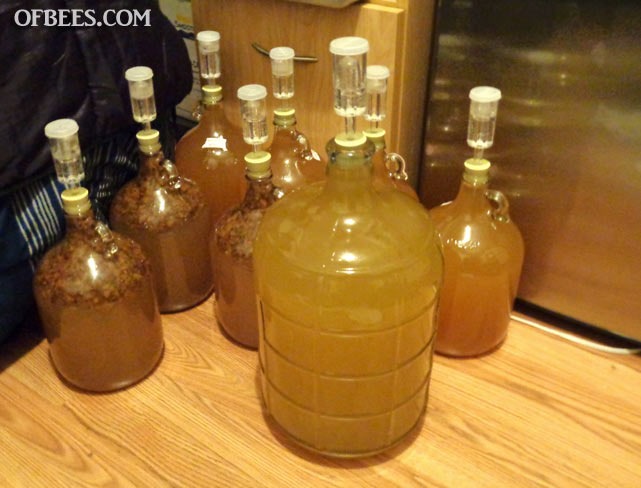
Find the location of `bottle`. bottle is located at coordinates (463, 316).